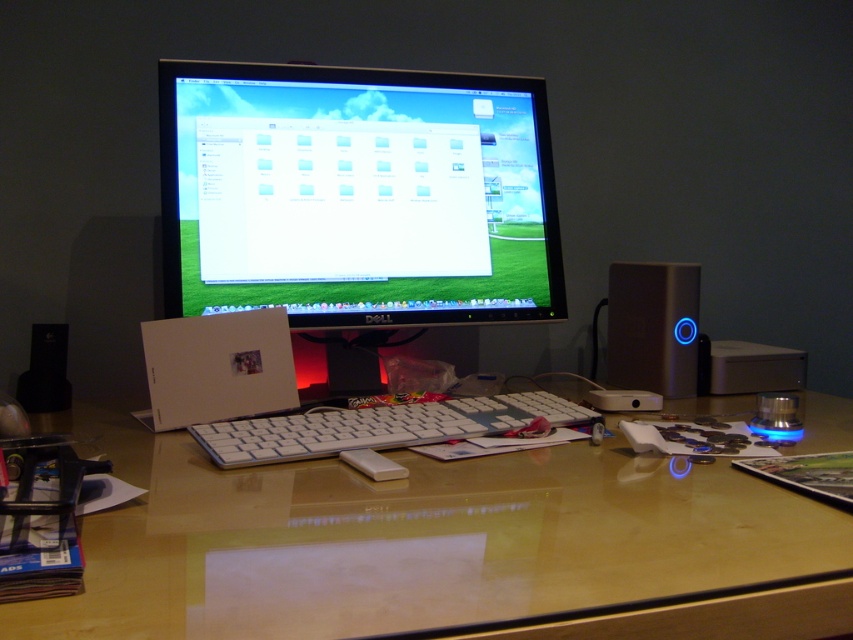
Is glossy wood computer desk at center bigger than satin silver speaker at right?

Yes.

Is glossy wood computer desk at center in front of satin silver speaker at right?

→ Yes, glossy wood computer desk at center is closer to the viewer.

Between point (263, 516) and point (650, 358), which one is positioned in front?

Point (263, 516)

Where is `glossy wood computer desk at center`? The image size is (853, 640). glossy wood computer desk at center is located at coordinates (447, 548).

Between white plastic monitor at center and satin silver speaker at right, which one has less height?

satin silver speaker at right

Looking at this image, does white plastic monitor at center appear under satin silver speaker at right?

Actually, white plastic monitor at center is above satin silver speaker at right.

Which is in front, point (289, 140) or point (608, 298)?

Point (289, 140) is more forward.

Where is `white plastic monitor at center`? The image size is (853, 640). white plastic monitor at center is located at coordinates (357, 202).

Is glossy wood computer desk at center taller than white plastic monitor at center?

No, glossy wood computer desk at center is not taller than white plastic monitor at center.

Can you confirm if glossy wood computer desk at center is positioned below white plastic monitor at center?

Indeed, glossy wood computer desk at center is positioned under white plastic monitor at center.

Between point (805, 588) and point (350, 394), which one is positioned in front?

Positioned in front is point (805, 588).

You are a GUI agent. You are given a task and a screenshot of the screen. Output one action in this format:
    pyautogui.click(x=<x>, y=<y>)
    Task: Click on the glossy wood computer desk at center
    This screenshot has height=640, width=853.
    Given the screenshot: What is the action you would take?
    pyautogui.click(x=447, y=548)